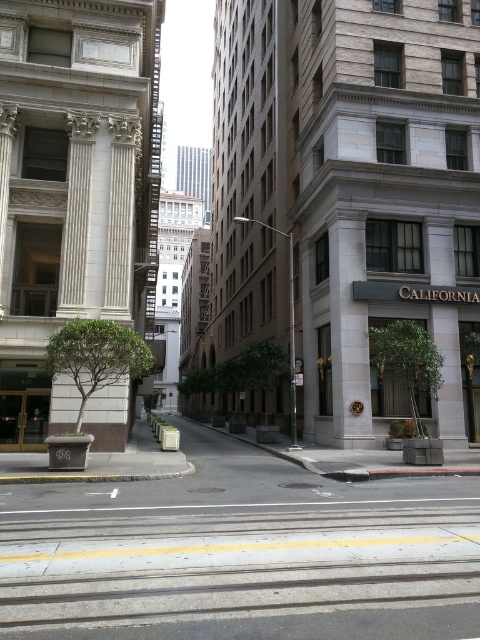
You are standing at the center of the street and want to find the white marble pillar at left. In which direction should you look to see it?

The white marble pillar at left is located at point (120,218), which is to the left side of the scene. Therefore, you should look to your left to see it.

You are standing in the middle of the street in front of the white marble pillar at left. You want to walk to the pillar. How many steps will you need to take if each step is about 2.5 feet?

The distance between you and the white marble pillar at left is 50.74 feet. Dividing that by 2.5 feet per step gives approximately 20.3 steps. Since you can only take whole steps, you will need to take 21 steps to reach the white marble pillar at left.

You are standing at the camera position in the downtown street scene. There is a point marked at coordinates point (136,140). Can you determine if this point is within a safe distance for a drone to land, considering the drone requires a minimum of 20 meters of clearance from any obstacles?

The point (136,140) is 22.50 meters away from the camera. Since the drone requires a minimum of 20 meters of clearance, the point is within the safe distance for landing.